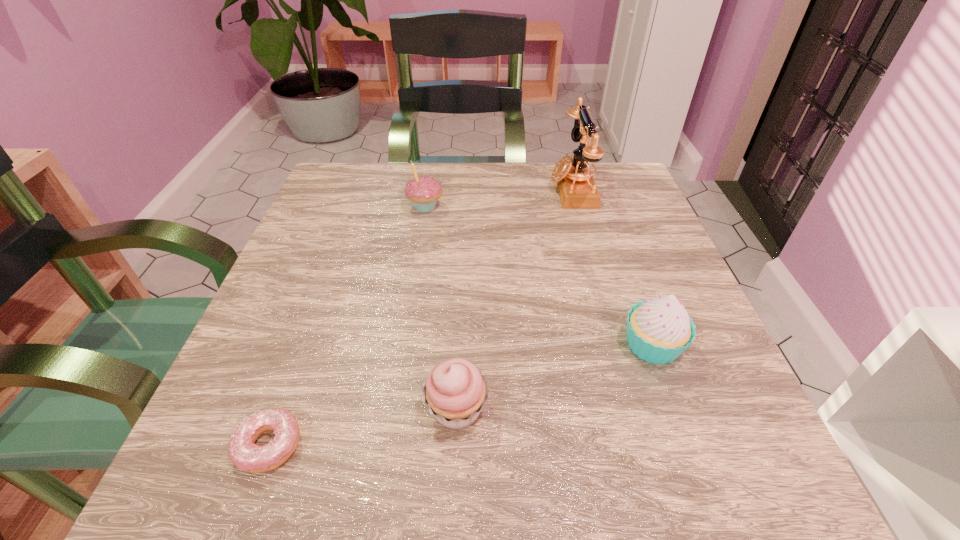
Where is `telephone`? The height and width of the screenshot is (540, 960). telephone is located at coordinates (577, 190).

Find the location of `the fourth object from right to left`. the fourth object from right to left is located at coordinates (423, 191).

Find the location of a particular element. The image size is (960, 540). the farthest cupcake is located at coordinates (423, 191).

At what (x,y) coordinates should I click in order to perform the action: click on the rightmost cupcake. Please return your answer as a coordinate pair (x, y). This screenshot has height=540, width=960. Looking at the image, I should click on [659, 330].

Locate an element on the screen. The width and height of the screenshot is (960, 540). the second farthest cupcake is located at coordinates (659, 330).

Where is `the nearest cupcake`? The width and height of the screenshot is (960, 540). the nearest cupcake is located at coordinates (455, 391).

Where is `the third object from right to left`? the third object from right to left is located at coordinates (455, 391).

This screenshot has height=540, width=960. I want to click on the shortest object, so click(243, 452).

I want to click on doughnut, so click(243, 452).

Where is `vacant space situated 0.350m on the dial of the tallest object`? The height and width of the screenshot is (540, 960). vacant space situated 0.350m on the dial of the tallest object is located at coordinates (403, 188).